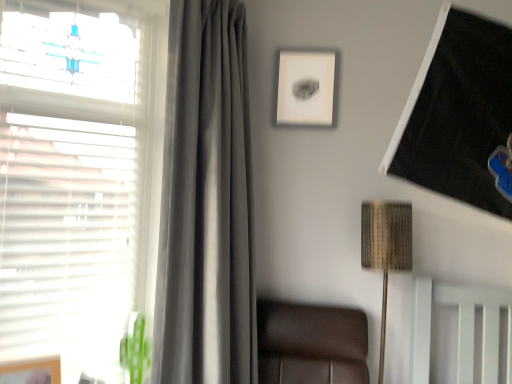
Question: From a real-world perspective, is satin gray curtain at left positioned over white matte window at left based on gravity?

Choices:
 (A) no
 (B) yes

Answer: (A)

Question: Can you see satin gray curtain at left touching white matte window at left?

Choices:
 (A) yes
 (B) no

Answer: (B)

Question: Are satin gray curtain at left and white matte window at left far apart?

Choices:
 (A) yes
 (B) no

Answer: (B)

Question: From the image's perspective, is satin gray curtain at left beneath white matte window at left?

Choices:
 (A) yes
 (B) no

Answer: (A)

Question: Is the position of satin gray curtain at left less distant than that of white matte window at left?

Choices:
 (A) no
 (B) yes

Answer: (A)

Question: Is woven fabric lampshade at upper right spatially inside satin gray curtain at left, or outside of it?

Choices:
 (A) inside
 (B) outside

Answer: (B)

Question: From a real-world perspective, is woven fabric lampshade at upper right positioned above or below satin gray curtain at left?

Choices:
 (A) below
 (B) above

Answer: (A)

Question: Is woven fabric lampshade at upper right to the left or to the right of satin gray curtain at left in the image?

Choices:
 (A) left
 (B) right

Answer: (B)

Question: Considering the positions of woven fabric lampshade at upper right and satin gray curtain at left in the image, is woven fabric lampshade at upper right bigger or smaller than satin gray curtain at left?

Choices:
 (A) small
 (B) big

Answer: (A)

Question: In terms of height, does matte white picture frame at upper center, which ranks as the 1th picture frame in top-to-bottom order, look taller or shorter compared to wooden picture frame at lower left, the 1th picture frame ordered from the bottom?

Choices:
 (A) tall
 (B) short

Answer: (A)

Question: Would you say matte white picture frame at upper center, which ranks as the 1th picture frame in top-to-bottom order, is to the left or to the right of wooden picture frame at lower left, the second picture frame positioned from the right, in the picture?

Choices:
 (A) left
 (B) right

Answer: (B)

Question: From the image's perspective, is matte white picture frame at upper center, acting as the 2th picture frame starting from the left, located above or below wooden picture frame at lower left, the second picture frame positioned from the right?

Choices:
 (A) above
 (B) below

Answer: (A)

Question: Considering the positions of matte white picture frame at upper center, which ranks as the 1th picture frame in top-to-bottom order, and wooden picture frame at lower left, acting as the first picture frame starting from the front, in the image, is matte white picture frame at upper center, which ranks as the 1th picture frame in top-to-bottom order, bigger or smaller than wooden picture frame at lower left, acting as the first picture frame starting from the front,?

Choices:
 (A) big
 (B) small

Answer: (B)

Question: Is satin gray curtain at left bigger or smaller than white matte window at left?

Choices:
 (A) big
 (B) small

Answer: (A)

Question: Does point (176, 196) appear closer or farther from the camera than point (7, 172)?

Choices:
 (A) farther
 (B) closer

Answer: (A)